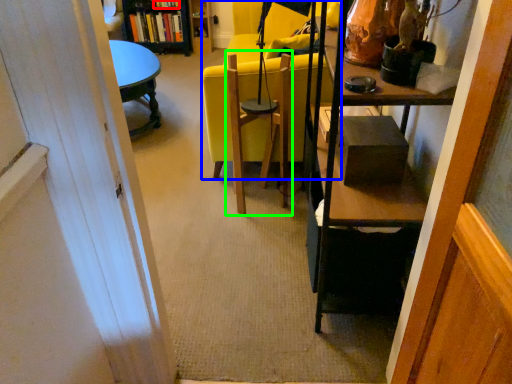
Question: Considering the real-world distances, which object is farthest from book (highlighted by a red box)? chair (highlighted by a blue box) or swivel chair (highlighted by a green box)?

Choices:
 (A) chair
 (B) swivel chair

Answer: (B)